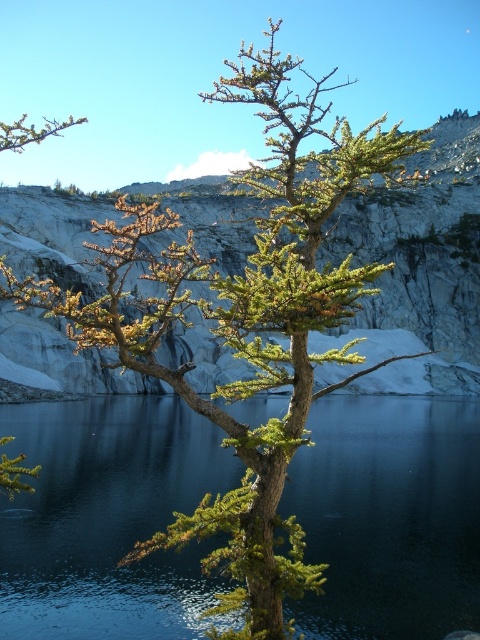
You are a hiker who wants to cross from the green glossy water at center to the green textured rock at center. Can you step directly from one to the other without any obstacles?

The green glossy water at center is in front of the green textured rock at center, so there is no obstacle between them. You can step directly from the green glossy water at center to the green textured rock at center.

You are a hiker standing at the base of the mountain. You see the green glossy water at center and the green textured rock at center. Which object is closer to the ground?

The green glossy water at center is closer to the ground than the green textured rock at center because it is not as tall.

You are standing in the landscape scene and want to cross to the other side. You see the green glossy water at center and the green textured rock at center. Which object should you step on to avoid getting wet?

You should step on the green textured rock at center because the green glossy water at center is to its right, and stepping on the rock will keep you dry.